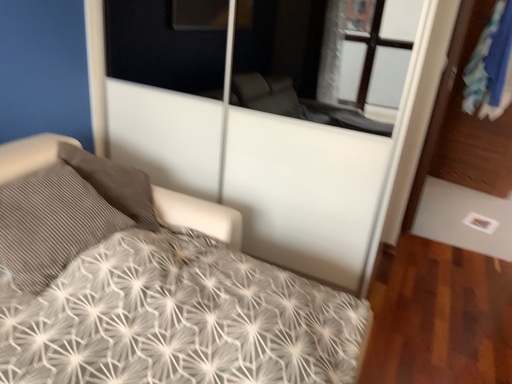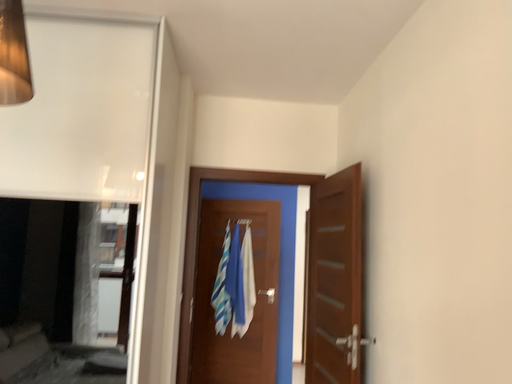
Question: Which way did the camera rotate in the video?

Choices:
 (A) rotated left
 (B) rotated right

Answer: (B)